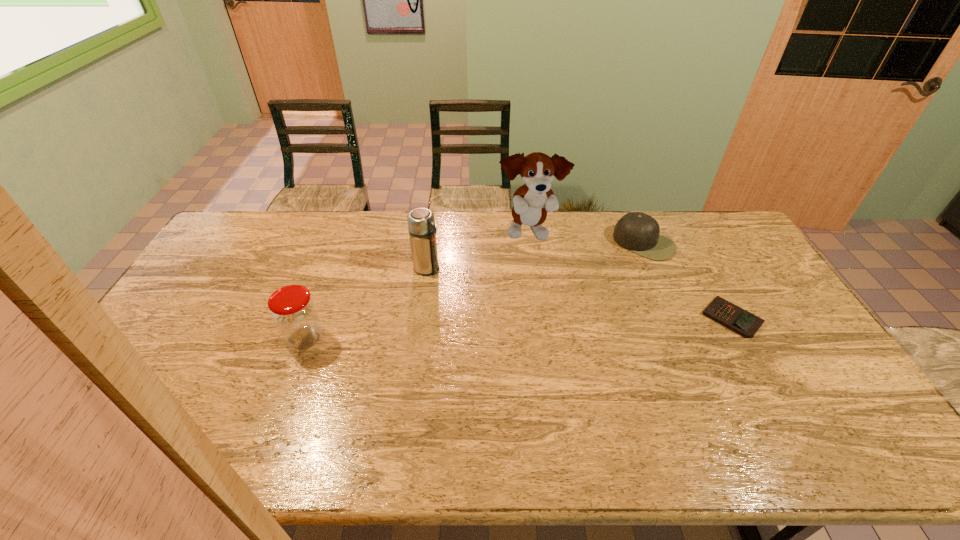
In order to click on jar in this screenshot , I will do `click(293, 311)`.

Identify the location of the third shortest object. (293, 311).

At what (x,y) coordinates should I click in order to perform the action: click on the shortest object. Please return your answer as a coordinate pair (x, y). Image resolution: width=960 pixels, height=540 pixels. Looking at the image, I should click on (733, 317).

At what (x,y) coordinates should I click in order to perform the action: click on cap. Please return your answer as a coordinate pair (x, y). This screenshot has width=960, height=540. Looking at the image, I should click on (636, 231).

At what (x,y) coordinates should I click in order to perform the action: click on the second object from left to right. Please return your answer as a coordinate pair (x, y). Image resolution: width=960 pixels, height=540 pixels. Looking at the image, I should click on (421, 223).

You are a GUI agent. You are given a task and a screenshot of the screen. Output one action in this format:
    pyautogui.click(x=<x>, y=<y>)
    Task: Click on the fourth shortest object
    The image size is (960, 540).
    Given the screenshot: What is the action you would take?
    pyautogui.click(x=421, y=223)

Where is `the tallest object`? the tallest object is located at coordinates (532, 201).

The image size is (960, 540). What are the coordinates of `the third object from right to left` in the screenshot? It's located at (532, 201).

This screenshot has width=960, height=540. Find the location of `blank space located 0.390m on the right of the leftmost object`. blank space located 0.390m on the right of the leftmost object is located at coordinates (460, 338).

Find the location of a particular element. The width and height of the screenshot is (960, 540). vacant region located 0.390m on the back of the calculator is located at coordinates (681, 225).